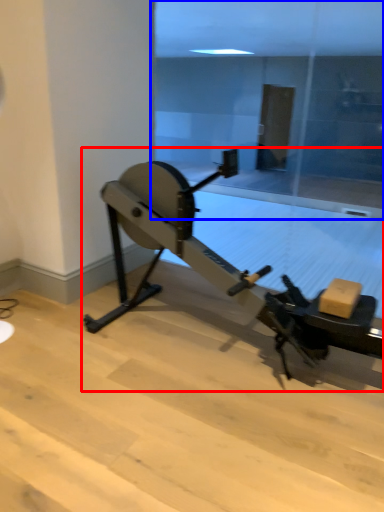
Question: Which object is further to the camera taking this photo, stationary bicycle (highlighted by a red box) or glass door (highlighted by a blue box)?

Choices:
 (A) stationary bicycle
 (B) glass door

Answer: (B)